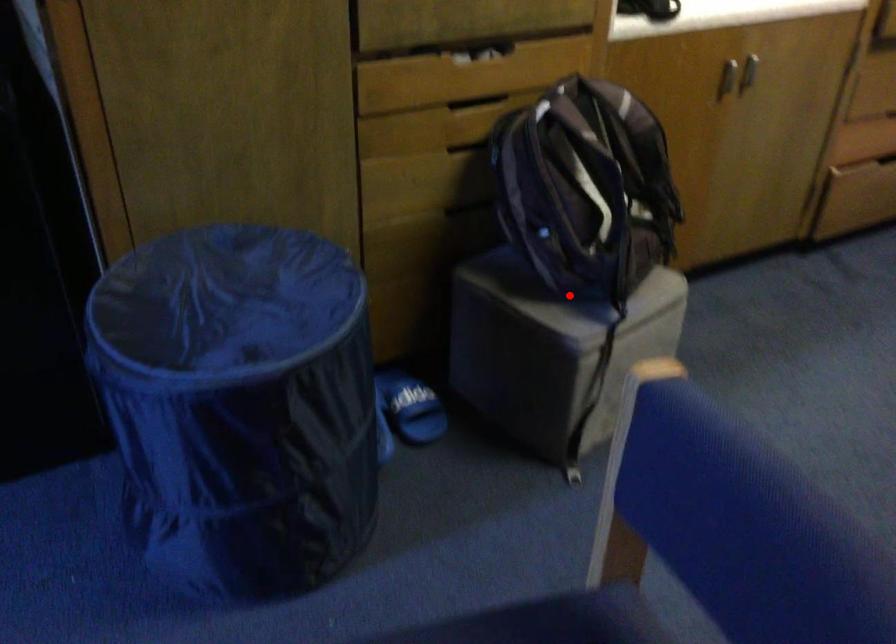
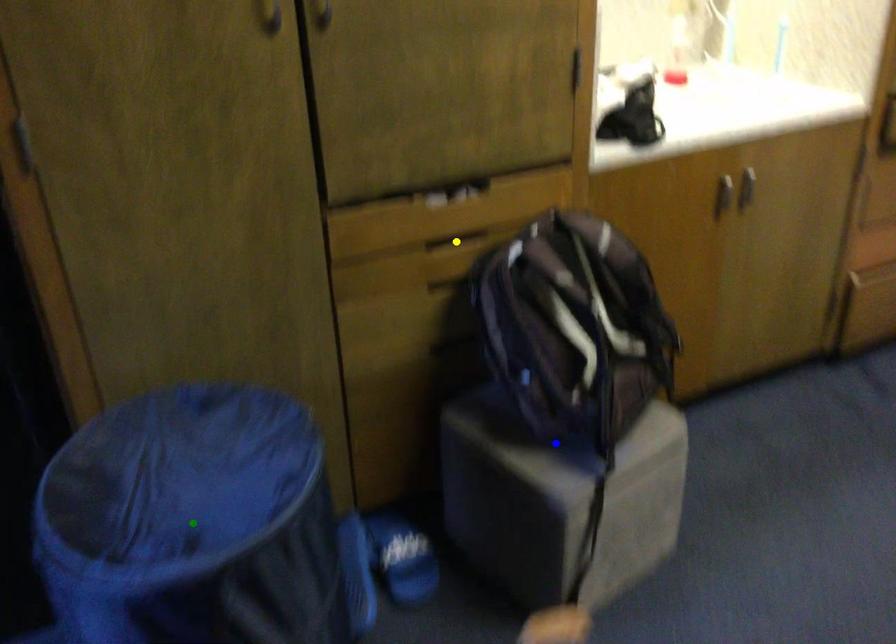
Question: I am providing you with two images of the same scene from different viewpoints. A red point is marked on the first image. You are given multiple points on the second image. Which point in image 2 is actually the same real-world point as the red point in image 1?

Choices:
 (A) yellow point
 (B) green point
 (C) blue point

Answer: (C)